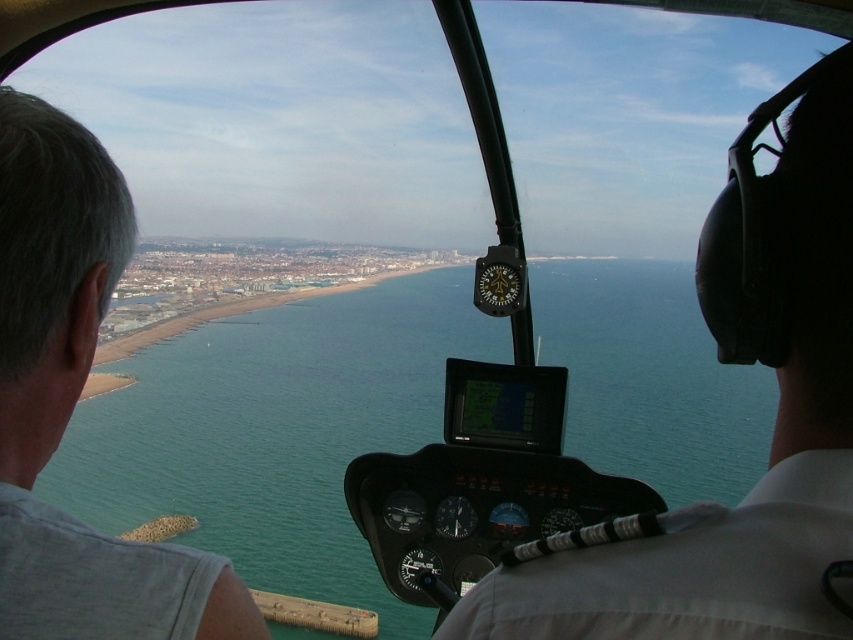
You are a passenger seated in the helicopter cockpit. You notice two objects inside the cockpit. One is the white fabric at upper right and the other is the gray hair at left. Which object is located more to the right side of the cockpit?

The white fabric at upper right is positioned on the right side of gray hair at left, so the white fabric at upper right is more to the right side of the cockpit.